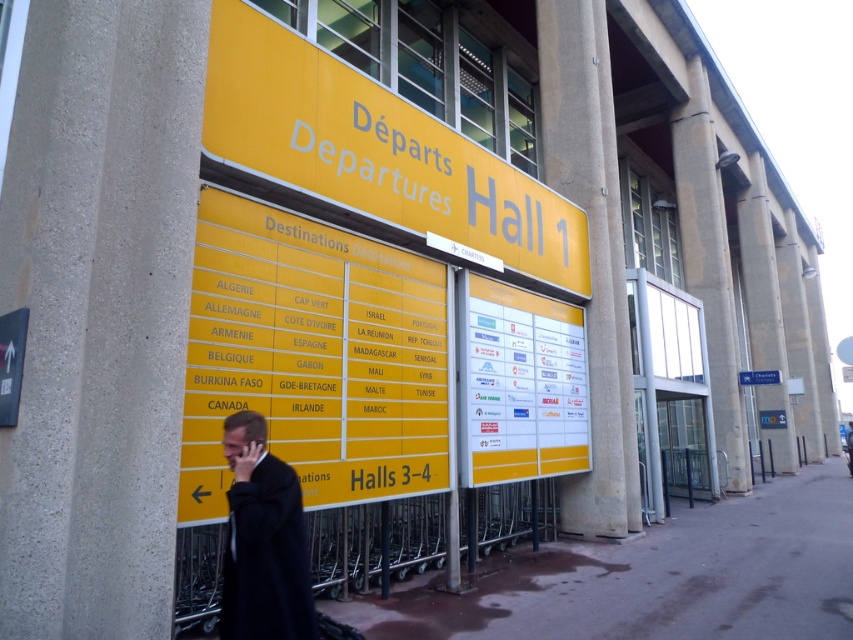
From the picture: Can you confirm if yellow matte sign at upper center is taller than yellow paperboard sign at center?

No, yellow matte sign at upper center is not taller than yellow paperboard sign at center.

The image size is (853, 640). Describe the element at coordinates (376, 152) in the screenshot. I see `yellow matte sign at upper center` at that location.

This screenshot has height=640, width=853. Find the location of `yellow matte sign at upper center`. yellow matte sign at upper center is located at coordinates (376, 152).

Can you confirm if dark gray asphalt at lower center is thinner than yellow matte sign at upper center?

In fact, dark gray asphalt at lower center might be wider than yellow matte sign at upper center.

From the picture: Between dark gray asphalt at lower center and yellow matte sign at upper center, which one appears on the left side from the viewer's perspective?

yellow matte sign at upper center is more to the left.

At what (x,y) coordinates should I click in order to perform the action: click on dark gray asphalt at lower center. Please return your answer as a coordinate pair (x, y). The image size is (853, 640). Looking at the image, I should click on (654, 577).

Image resolution: width=853 pixels, height=640 pixels. I want to click on dark gray asphalt at lower center, so click(654, 577).

Is dark gray asphalt at lower center to the left of black wool coat at center from the viewer's perspective?

No, dark gray asphalt at lower center is not to the left of black wool coat at center.

Between point (498, 600) and point (283, 554), which one is positioned in front?

Point (283, 554)

Locate an element on the screen. The width and height of the screenshot is (853, 640). dark gray asphalt at lower center is located at coordinates (654, 577).